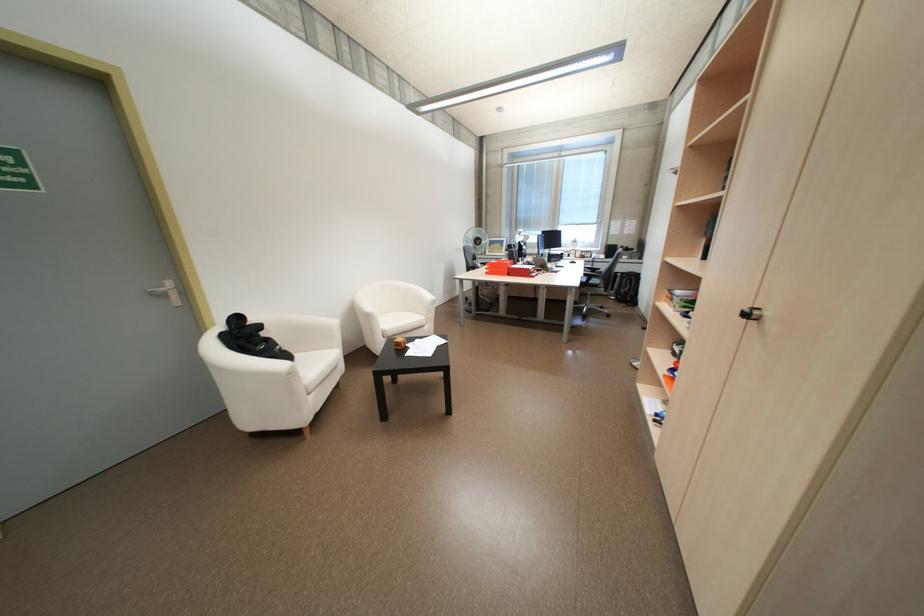
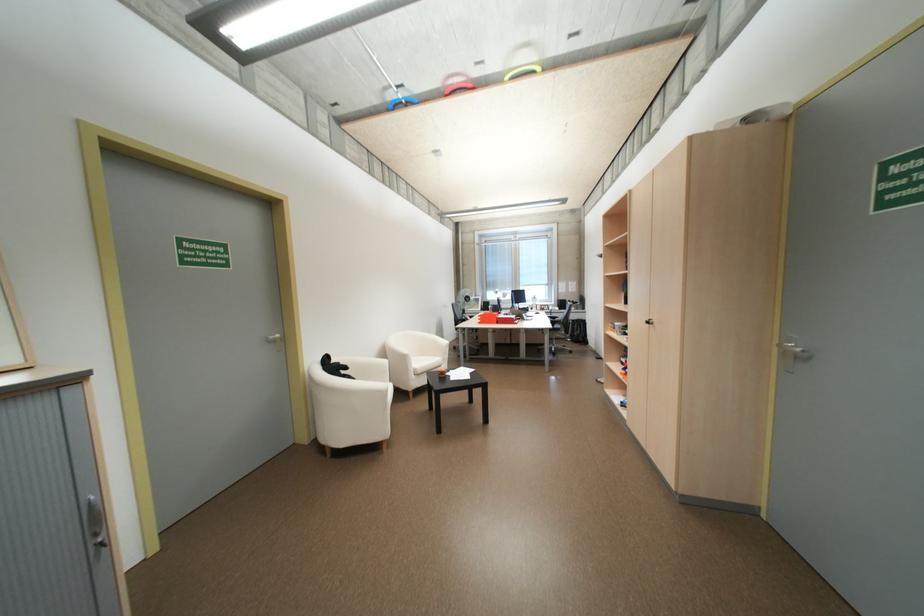
Where in the second image is the point corresponding to [174,289] from the first image?

(281, 336)